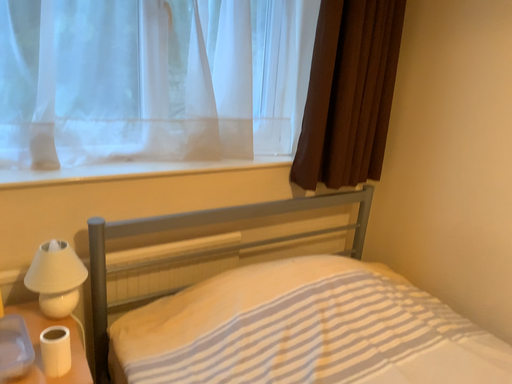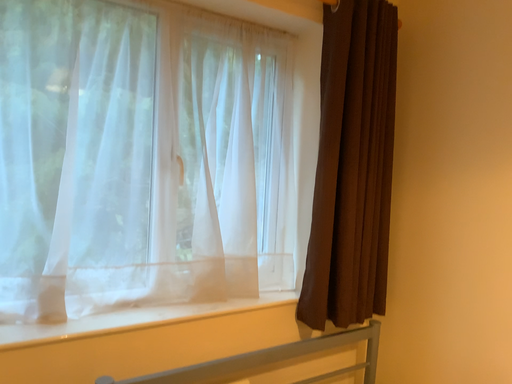
Question: Which way did the camera rotate in the video?

Choices:
 (A) rotated downward
 (B) rotated upward

Answer: (B)